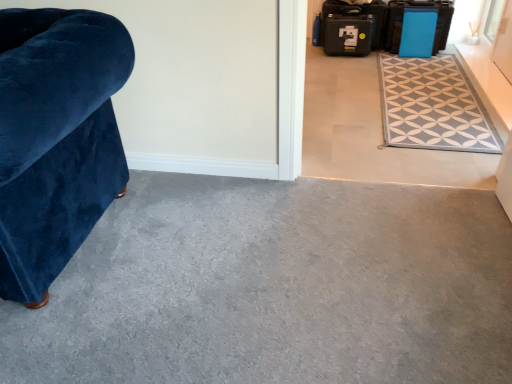
Question: Is velvet blue armchair at left to the right of black plastic suitcase at upper right, which is the 3th luggage from right to left, from the viewer's perspective?

Choices:
 (A) no
 (B) yes

Answer: (A)

Question: Is velvet blue armchair at left aimed at black plastic suitcase at upper right, the first luggage in the left-to-right sequence?

Choices:
 (A) no
 (B) yes

Answer: (A)

Question: Is velvet blue armchair at left positioned behind black plastic suitcase at upper right, which is the 3th luggage from right to left?

Choices:
 (A) no
 (B) yes

Answer: (A)

Question: Is velvet blue armchair at left shorter than black plastic suitcase at upper right, which is the 3th luggage from right to left?

Choices:
 (A) no
 (B) yes

Answer: (A)

Question: Would you say velvet blue armchair at left is outside black plastic suitcase at upper right, which is the 3th luggage from right to left?

Choices:
 (A) yes
 (B) no

Answer: (A)

Question: From their relative heights in the image, would you say blue plastic suitcase at upper right, positioned as the 1th luggage in right-to-left order, is taller or shorter than gray fabric rug at upper right?

Choices:
 (A) tall
 (B) short

Answer: (A)

Question: In terms of width, does blue plastic suitcase at upper right, placed as the 3th luggage when sorted from left to right, look wider or thinner when compared to gray fabric rug at upper right?

Choices:
 (A) thin
 (B) wide

Answer: (A)

Question: Considering the relative positions of blue plastic suitcase at upper right, placed as the 3th luggage when sorted from left to right, and gray fabric rug at upper right in the image provided, is blue plastic suitcase at upper right, placed as the 3th luggage when sorted from left to right, to the left or to the right of gray fabric rug at upper right?

Choices:
 (A) left
 (B) right

Answer: (B)

Question: From a real-world perspective, is blue plastic suitcase at upper right, positioned as the 1th luggage in right-to-left order, positioned above or below gray fabric rug at upper right?

Choices:
 (A) below
 (B) above

Answer: (B)

Question: From the image's perspective, relative to blue matte suitcase at upper right, placed as the second luggage when sorted from right to left, is gray tile floor at center, the 1th concrete from the back, above or below?

Choices:
 (A) above
 (B) below

Answer: (B)

Question: Is gray tile floor at center, the 1th concrete from the back, wider or thinner than blue matte suitcase at upper right, which is the 2th luggage from left to right?

Choices:
 (A) wide
 (B) thin

Answer: (A)

Question: Is gray tile floor at center, placed as the 1th concrete when sorted from top to bottom, inside or outside of blue matte suitcase at upper right, placed as the second luggage when sorted from right to left?

Choices:
 (A) outside
 (B) inside

Answer: (A)

Question: Is gray tile floor at center, the second concrete when ordered from bottom to top, to the left or to the right of blue matte suitcase at upper right, which is the 2th luggage from left to right, in the image?

Choices:
 (A) right
 (B) left

Answer: (B)

Question: Considering the positions of blue matte suitcase at upper right, placed as the second luggage when sorted from right to left, and gray carpet at lower left, which appears as the 2th concrete when viewed from the back, in the image, is blue matte suitcase at upper right, placed as the second luggage when sorted from right to left, wider or thinner than gray carpet at lower left, which appears as the 2th concrete when viewed from the back,?

Choices:
 (A) wide
 (B) thin

Answer: (B)

Question: Visually, is blue matte suitcase at upper right, placed as the second luggage when sorted from right to left, positioned to the left or to the right of gray carpet at lower left, the first concrete viewed from the front?

Choices:
 (A) right
 (B) left

Answer: (A)